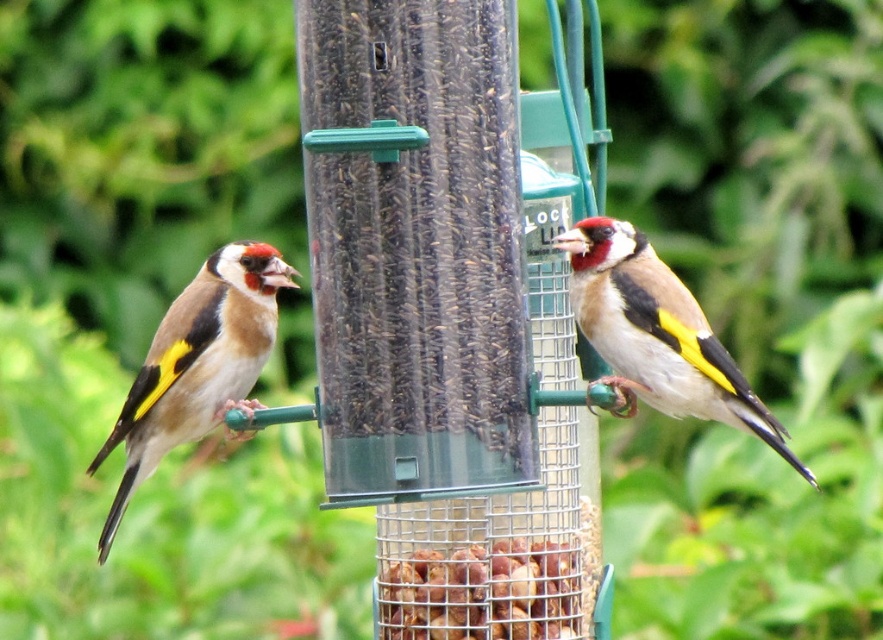
In the scene shown: You are standing in a garden and want to take a photo of the point at coordinates point (223,269). Your camera has a focal length of 50mm and a sensor size of 24mm. What is the minimum distance you need to be from the camera to ensure the point is in focus?

The point at coordinates point (223,269) is 3.32 meters away from the camera. Therefore, you need to be at least 3.32 meters away from the camera to ensure the point is in focus.